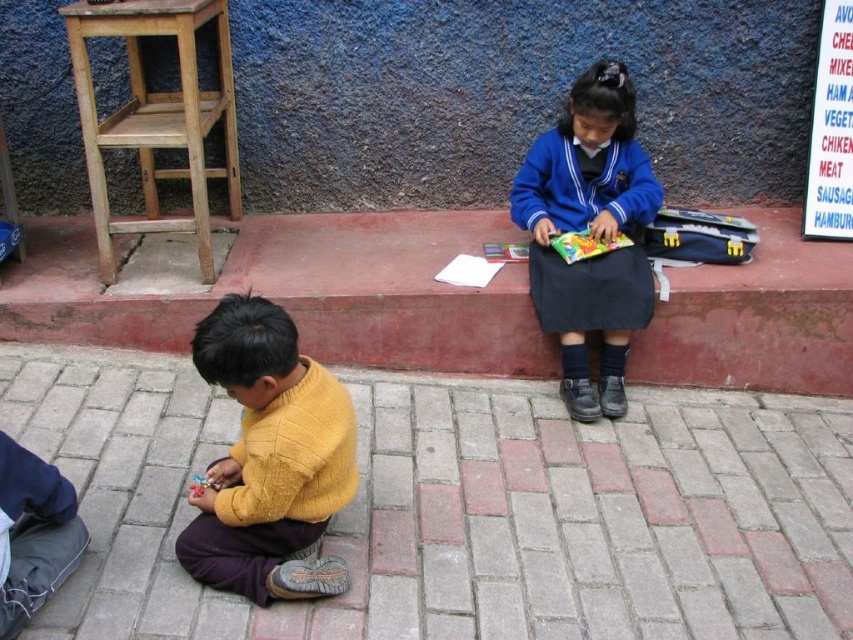
Is yellow knitted sweater at lower left taller than blue fabric uniform at center?

No, yellow knitted sweater at lower left is not taller than blue fabric uniform at center.

Is yellow knitted sweater at lower left wider than blue fabric uniform at center?

Incorrect, yellow knitted sweater at lower left's width does not surpass blue fabric uniform at center's.

I want to click on yellow knitted sweater at lower left, so click(270, 460).

At what (x,y) coordinates should I click in order to perform the action: click on yellow knitted sweater at lower left. Please return your answer as a coordinate pair (x, y). Looking at the image, I should click on click(270, 460).

Who is positioned more to the left, brick at lower center or yellow knitted sweater at lower left?

From the viewer's perspective, brick at lower center appears more on the left side.

Looking at this image, who is more distant from viewer, (320, 243) or (322, 566)?

Point (320, 243)

Between point (439, 216) and point (315, 484), which one is positioned behind?

The point (439, 216) is more distant.

Locate an element on the screen. brick at lower center is located at coordinates (305, 291).

Between brick pavement at lower center and blue fabric uniform at center, which one appears on the left side from the viewer's perspective?

Positioned to the left is brick pavement at lower center.

Can you confirm if brick pavement at lower center is positioned to the left of blue fabric uniform at center?

Indeed, brick pavement at lower center is positioned on the left side of blue fabric uniform at center.

Is point (299, 627) in front of point (576, 118)?

Yes, it is.

This screenshot has height=640, width=853. What are the coordinates of `brick pavement at lower center` in the screenshot? It's located at (461, 508).